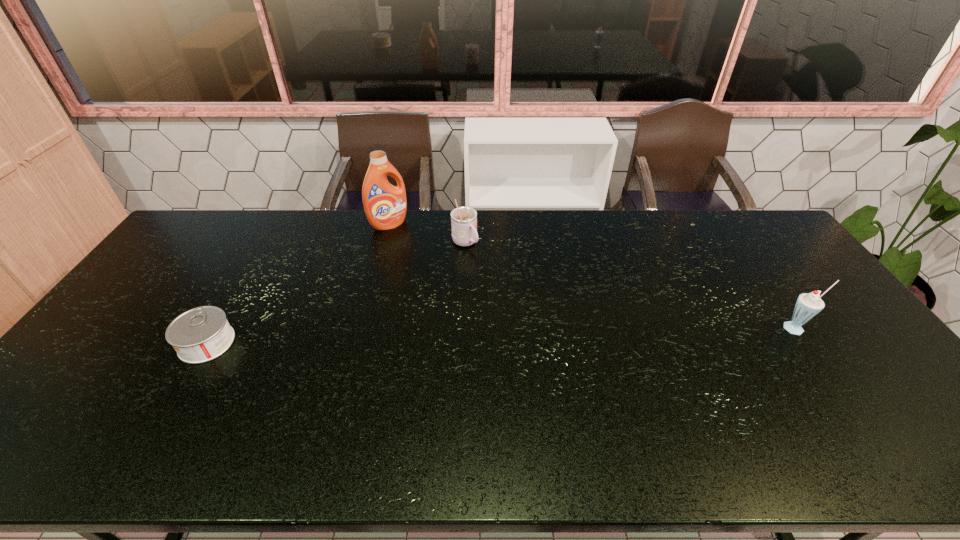
Identify the location of the leftmost object. (202, 334).

The image size is (960, 540). In order to click on can in this screenshot , I will do `click(202, 334)`.

Locate an element on the screen. The width and height of the screenshot is (960, 540). milkshake is located at coordinates (808, 305).

You are a GUI agent. You are given a task and a screenshot of the screen. Output one action in this format:
    pyautogui.click(x=<x>, y=<y>)
    Task: Click on the third object from left to right
    The height and width of the screenshot is (540, 960).
    Given the screenshot: What is the action you would take?
    pyautogui.click(x=463, y=219)

I want to click on the third tallest object, so click(463, 219).

Where is `the farthest object`? the farthest object is located at coordinates (385, 205).

This screenshot has width=960, height=540. I want to click on the third object from right to left, so click(x=385, y=205).

This screenshot has height=540, width=960. What are the coordinates of `blank area located on the left of the can` in the screenshot? It's located at (140, 343).

This screenshot has height=540, width=960. Find the location of `vacant space positioned on the straw side of the rightmost object`. vacant space positioned on the straw side of the rightmost object is located at coordinates (855, 410).

Locate an element on the screen. This screenshot has height=540, width=960. vacant space located on the side with the handle of the second farthest object is located at coordinates (541, 315).